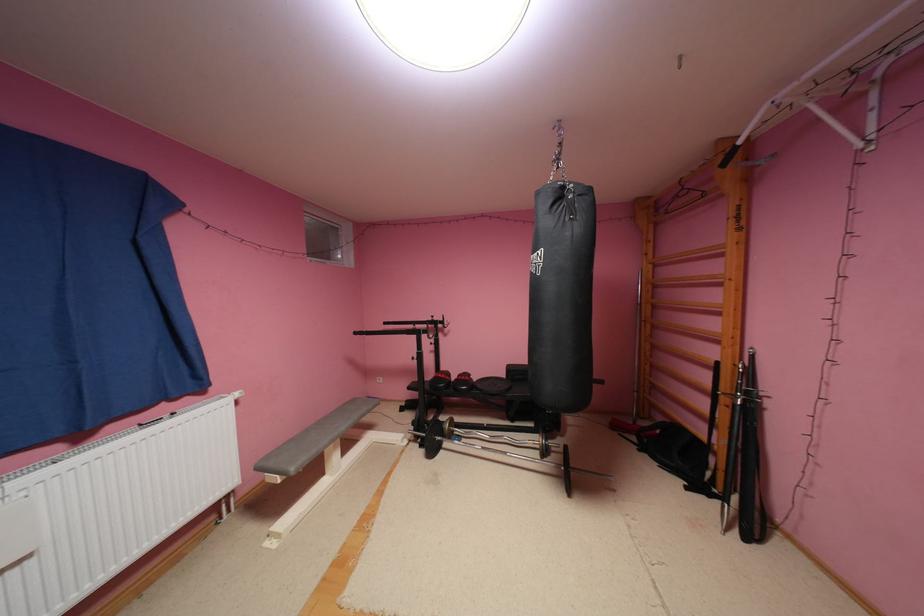
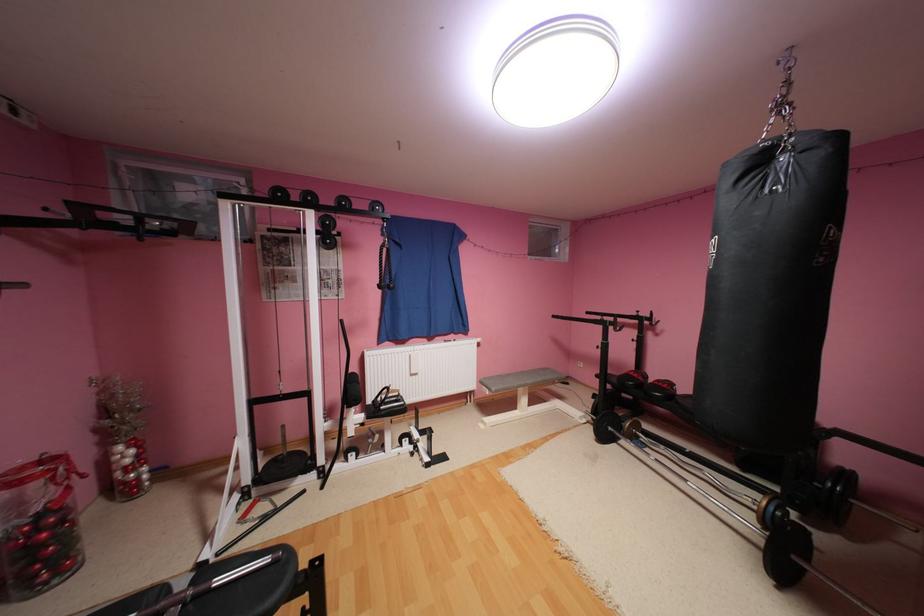
Where in the second image is the point corresponding to (x=415, y=440) from the first image?

(593, 419)